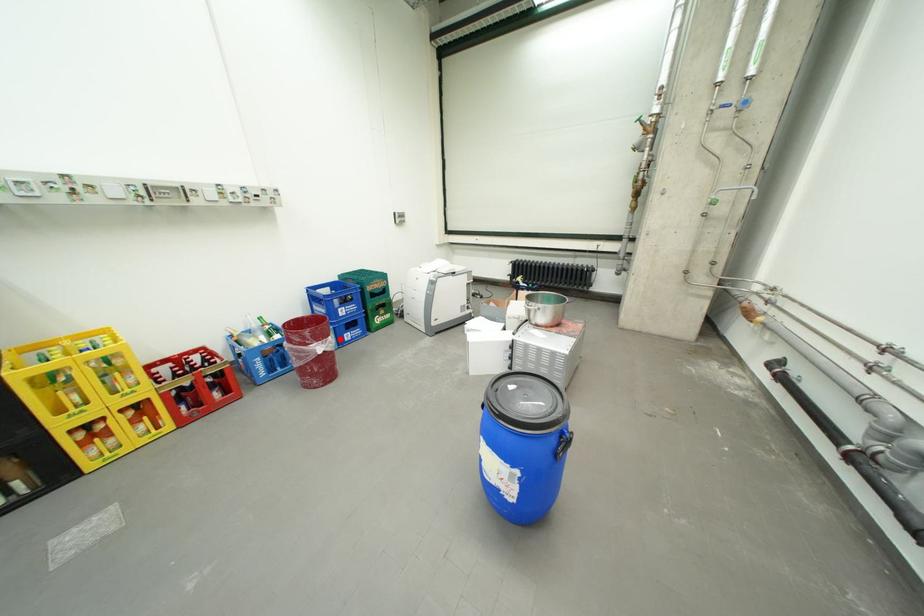
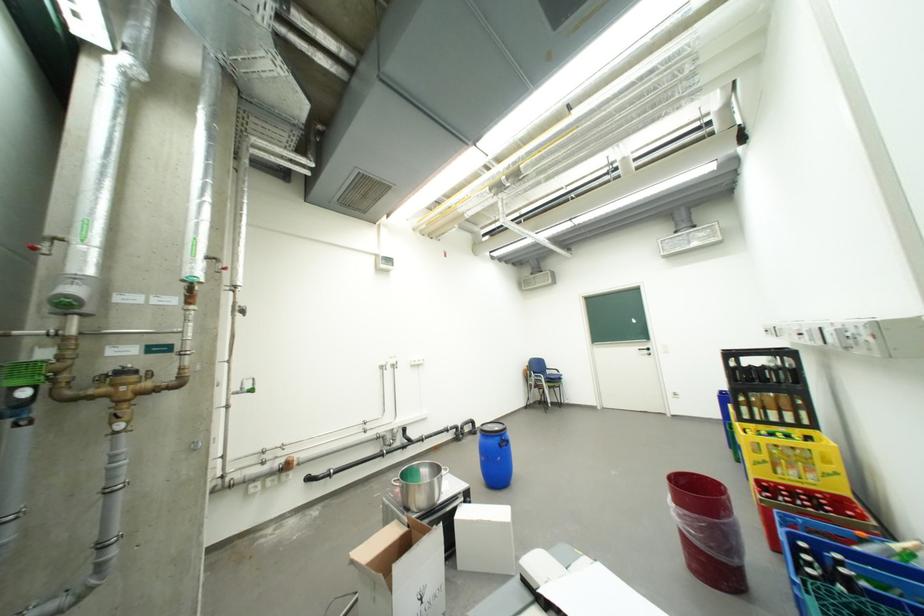
Question: I am providing you with two images of the same scene from different viewpoints. A red point is marked on the first image. Is the red point's position out of view in image 2?

Choices:
 (A) Yes
 (B) No

Answer: (B)